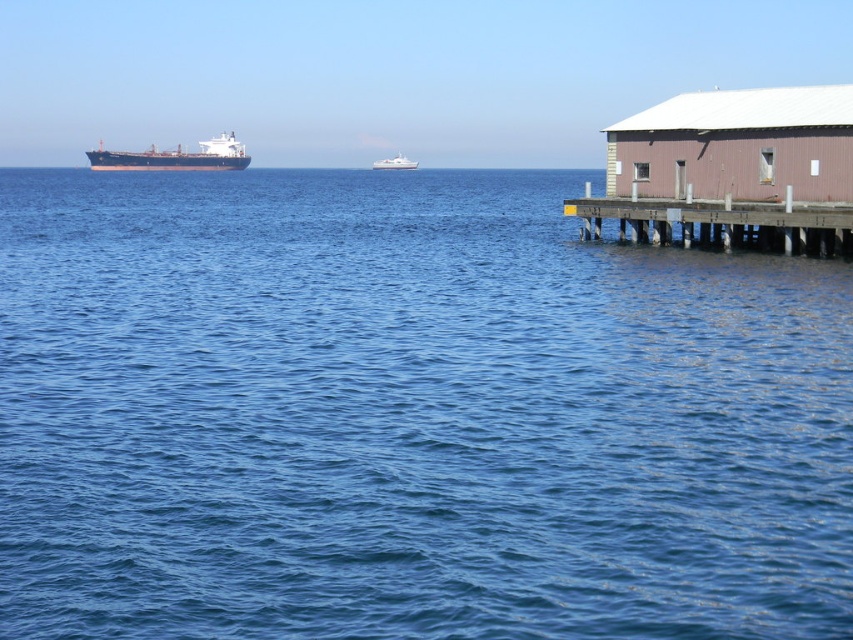
You are a photographer standing on the wooden pier and want to capture a photo of the blue water at center and the white glossy boat at center. Which object appears larger in the photo?

The blue water at center appears larger in the photo because it is much taller than the white glossy boat at center.